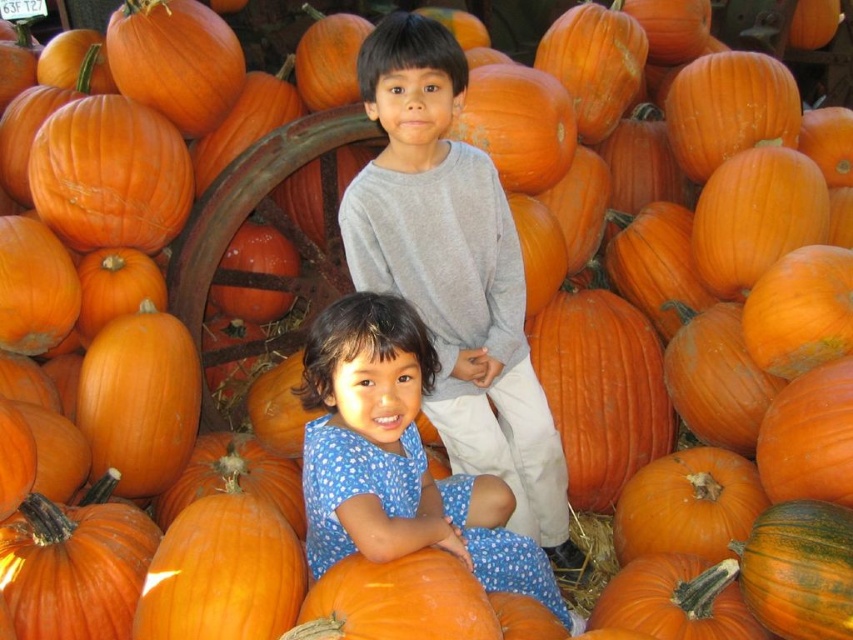
Question: Which object appears closest to the camera in this image?

Choices:
 (A) gray cotton shirt at center
 (B) blue dotted dress at center

Answer: (B)

Question: Which point is closer to the camera?

Choices:
 (A) blue dotted dress at center
 (B) gray cotton shirt at center

Answer: (A)

Question: Is gray cotton shirt at center further to camera compared to blue dotted dress at center?

Choices:
 (A) no
 (B) yes

Answer: (B)

Question: Is gray cotton shirt at center further to the viewer compared to blue dotted dress at center?

Choices:
 (A) no
 (B) yes

Answer: (B)

Question: Does gray cotton shirt at center have a greater width compared to blue dotted dress at center?

Choices:
 (A) no
 (B) yes

Answer: (A)